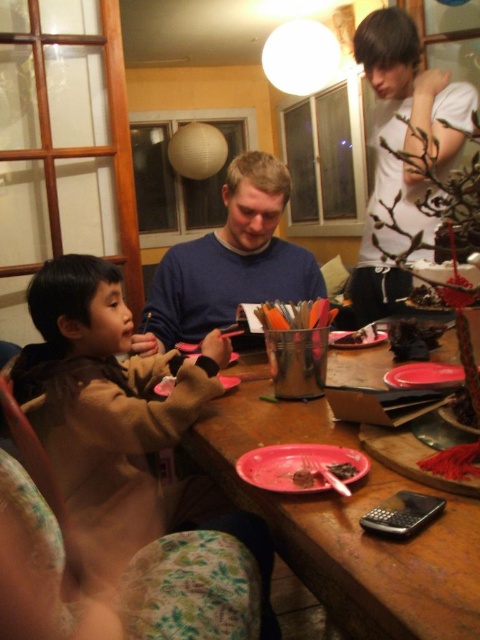
Question: Is pink matte plastic fork at lower center wider than smooth plastic fork at center?

Choices:
 (A) yes
 (B) no

Answer: (B)

Question: Which of these objects is positioned closest to the pink plastic plate at lower center?

Choices:
 (A) pink matte plastic fork at lower center
 (B) blue sweater at center

Answer: (A)

Question: From the image, what is the correct spatial relationship of matte plastic plate at lower center in relation to smooth plastic fork at center?

Choices:
 (A) right
 (B) left

Answer: (A)

Question: Which point is closer to the camera taking this photo?

Choices:
 (A) (441, 378)
 (B) (429, 84)

Answer: (A)

Question: Which object appears farthest from the camera in this image?

Choices:
 (A) blue sweater at center
 (B) smooth plastic fork at center
 (C) pink plastic plate at lower center

Answer: (B)

Question: Does wooden table at center appear on the right side of white matte shirt at upper right?

Choices:
 (A) no
 (B) yes

Answer: (A)